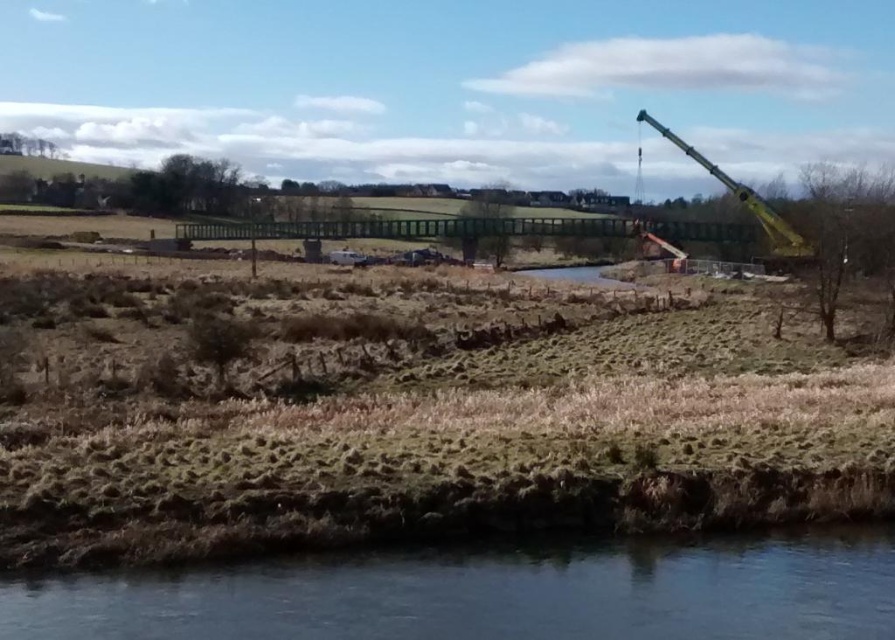
Question: Which of the following is the farthest from the observer?

Choices:
 (A) (776, 244)
 (B) (109, 573)

Answer: (A)

Question: Is clear water at lower left to the left of clear water at center from the viewer's perspective?

Choices:
 (A) no
 (B) yes

Answer: (B)

Question: Considering the real-world distances, which object is closest to the clear water at lower left?

Choices:
 (A) yellow metallic crane at upper right
 (B) clear water at center

Answer: (A)

Question: Which object is closer to the camera taking this photo?

Choices:
 (A) yellow metallic crane at upper right
 (B) clear water at lower left
 (C) clear water at center

Answer: (B)

Question: In this image, where is clear water at lower left located relative to clear water at center?

Choices:
 (A) above
 (B) below

Answer: (B)

Question: Is yellow metallic crane at upper right closer to the viewer compared to clear water at center?

Choices:
 (A) no
 (B) yes

Answer: (B)